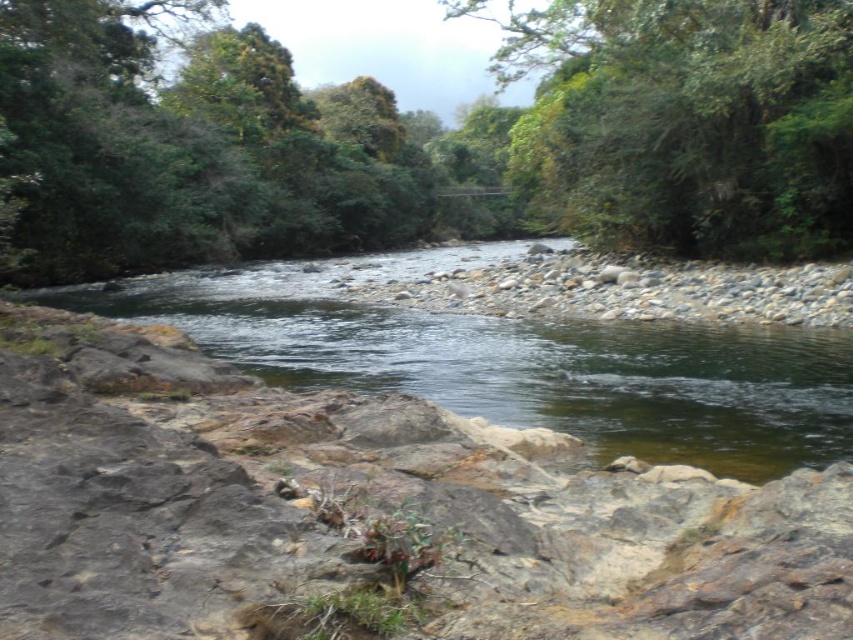
You are standing at point (732, 67) and want to reach point (108, 218). Based on the scene description, can you walk directly towards it without crossing the river?

Point (108, 218) is behind point (732, 67), so you would have to walk around or go through the river to reach it. Since the river is flowing through the area and the points are positioned such that one is behind the other, you cannot walk directly without crossing the river.

You are a hiker who wants to cross the river. You see the rocky at lower left and the clear water at center. Which path would you choose to cross the river safely?

You should choose the clear water at center because the rocky at lower left is positioned on the left side of it, meaning the clear water at center is likely calmer and safer for crossing.